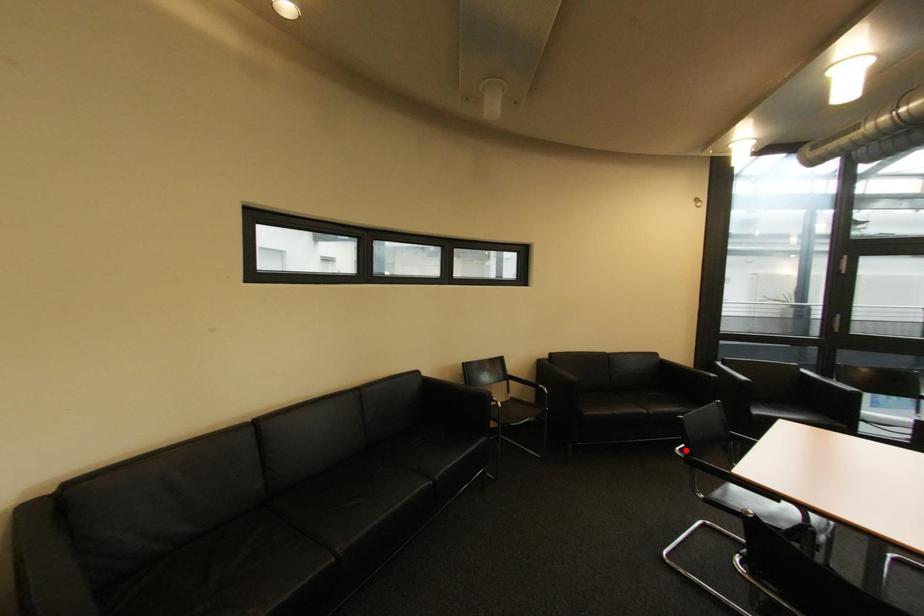
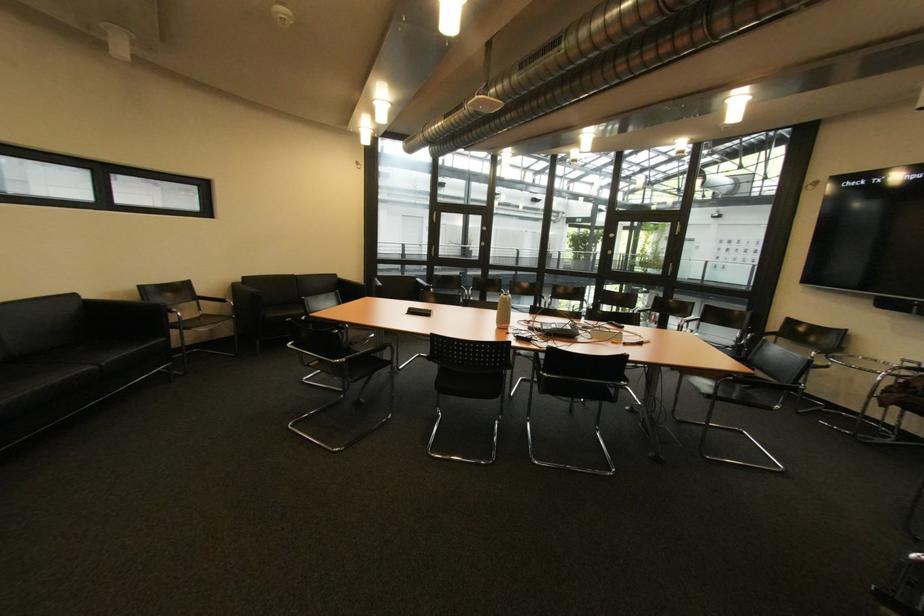
The point at the highlighted location is marked in the first image. Where is the corresponding point in the second image?

(312, 318)